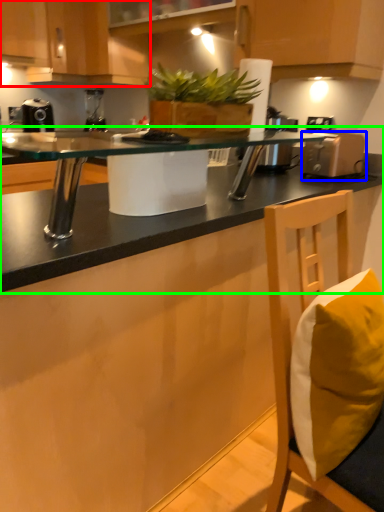
Question: Considering the real-world distances, which object is farthest from cabinetry (highlighted by a red box)? appliance (highlighted by a blue box) or countertop (highlighted by a green box)?

Choices:
 (A) appliance
 (B) countertop

Answer: (B)